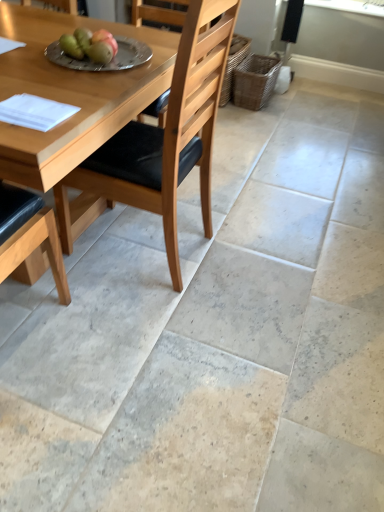
Where is `vacant area that lies in front of woven brown basket at right`? vacant area that lies in front of woven brown basket at right is located at coordinates (258, 120).